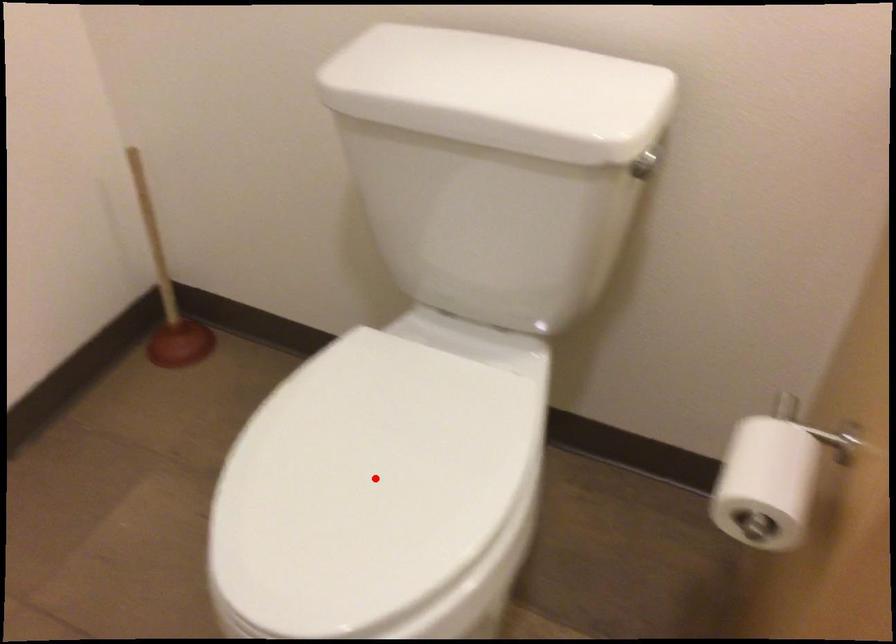
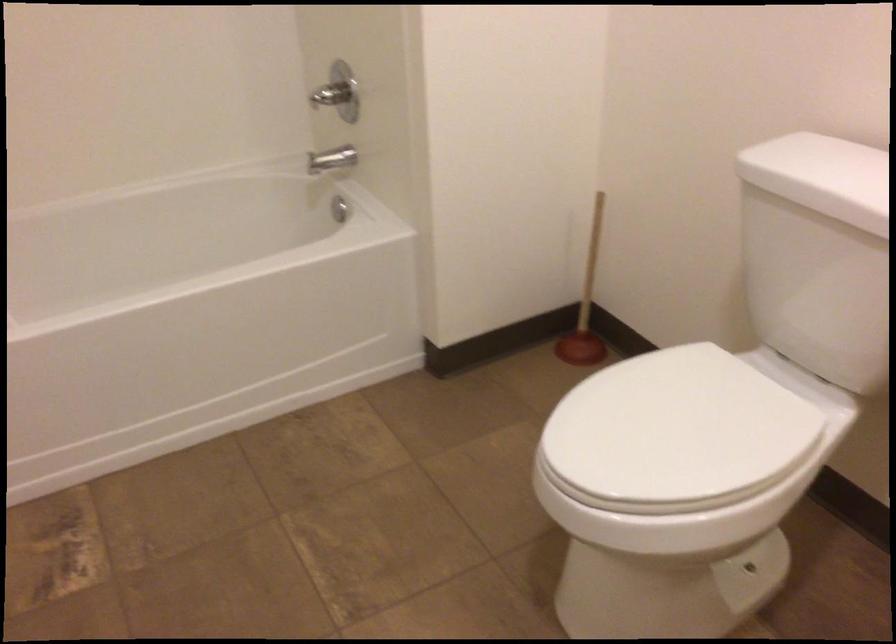
Question: I am providing you with two images of the same scene from different viewpoints. Given a red point in image1, look at the same physical point in image2. Is it:

Choices:
 (A) Closer to the viewpoint
 (B) Farther from the viewpoint

Answer: (B)